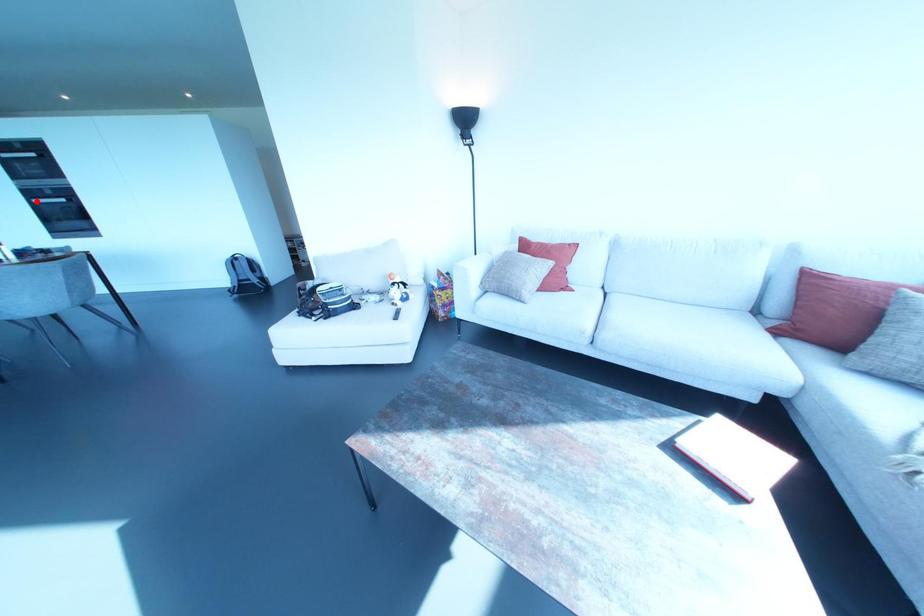
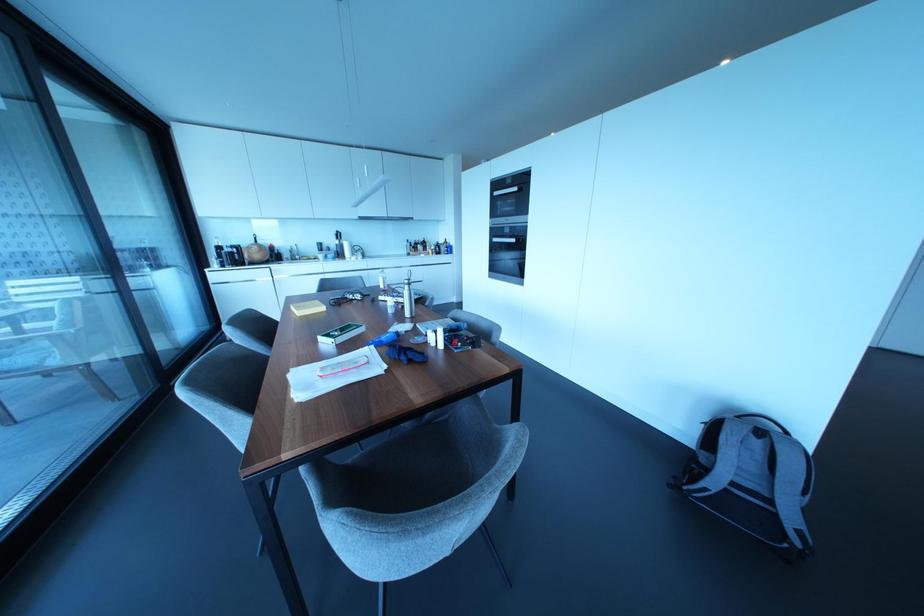
Question: I am providing you with two images of the same scene from different viewpoints. Image1 has a red point marked. In image2, the corresponding 3D location appears at what relative position? Reply with the corresponding letter.

Choices:
 (A) Closer
 (B) Farther

Answer: (A)